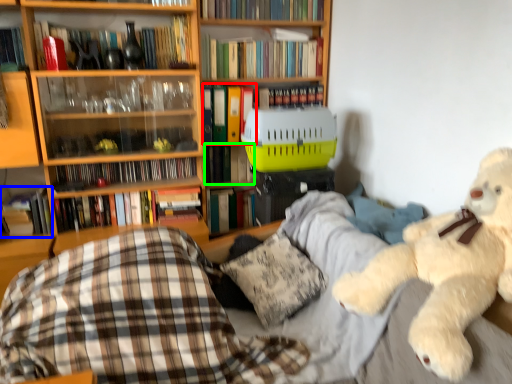
Question: Which is nearer to the book (highlighted by a red box)? book (highlighted by a blue box) or book (highlighted by a green box).

Choices:
 (A) book
 (B) book

Answer: (B)